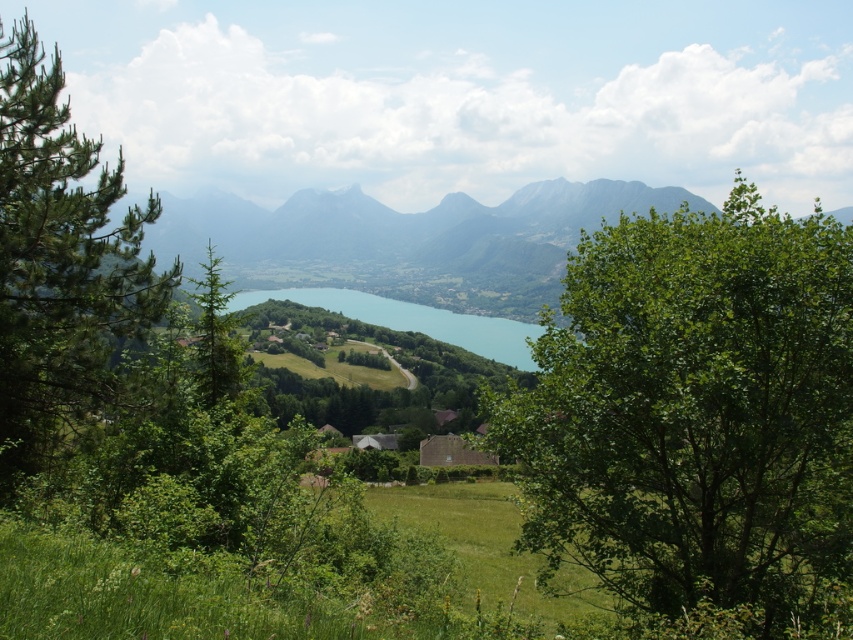
Question: Is green leafy tree at center positioned behind green needle-like tree at left?

Choices:
 (A) yes
 (B) no

Answer: (B)

Question: Is the position of green leafy tree at center more distant than that of turquoise glassy water at center?

Choices:
 (A) no
 (B) yes

Answer: (A)

Question: Which of these objects is positioned closest to the green needle-like tree at left?

Choices:
 (A) green leafy tree at center
 (B) turquoise glassy water at center

Answer: (A)

Question: Among these points, which one is nearest to the camera?

Choices:
 (A) (18, 300)
 (B) (405, 317)
 (C) (712, 358)

Answer: (C)

Question: Does green leafy tree at center have a greater width compared to turquoise glassy water at center?

Choices:
 (A) no
 (B) yes

Answer: (A)

Question: Based on their relative distances, which object is farther from the green leafy tree at center?

Choices:
 (A) green needle-like tree at left
 (B) turquoise glassy water at center

Answer: (B)